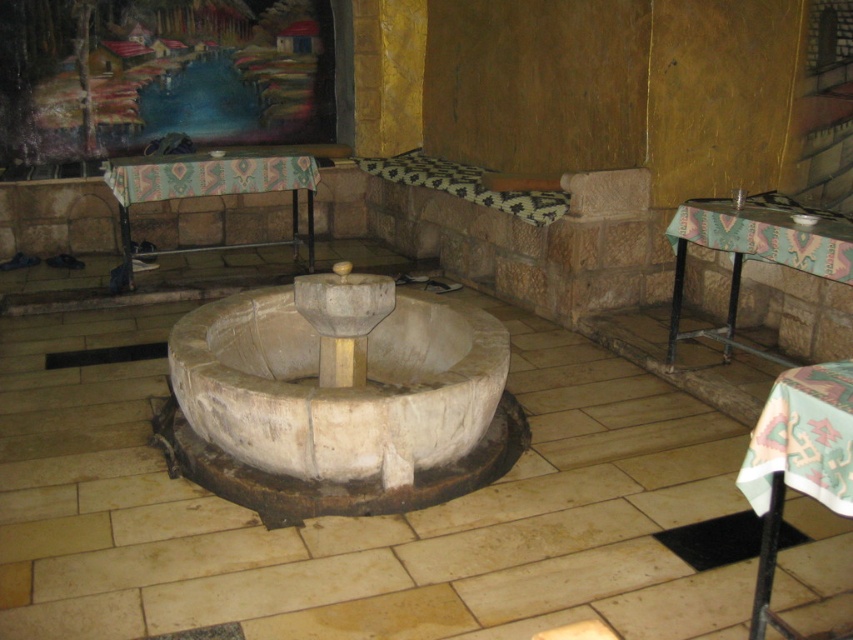
Is patterned fabric table at lower right shorter than patterned fabric table at left?

Correct, patterned fabric table at lower right is not as tall as patterned fabric table at left.

Is patterned fabric table at lower right in front of patterned fabric table at left?

Yes, patterned fabric table at lower right is in front of patterned fabric table at left.

Is point (824, 420) closer to viewer compared to point (146, 186)?

Yes, it is.

Identify the location of patterned fabric table at lower right. The width and height of the screenshot is (853, 640). (798, 461).

Can you confirm if smooth stone fountain at center is thinner than patterned fabric table at left?

No, smooth stone fountain at center is not thinner than patterned fabric table at left.

How much distance is there between smooth stone fountain at center and patterned fabric table at left?

They are 7.43 feet apart.

Who is more distant from viewer, (283, 394) or (292, 163)?

The point (292, 163) is more distant.

Where is `smooth stone fountain at center`? smooth stone fountain at center is located at coordinates (340, 397).

Is smooth stone fountain at center above textured fabric table at center?

No.

Is point (456, 476) farther from viewer compared to point (706, 236)?

No, (456, 476) is in front of (706, 236).

You are a GUI agent. You are given a task and a screenshot of the screen. Output one action in this format:
    pyautogui.click(x=<x>, y=<y>)
    Task: Click on the smooth stone fountain at center
    This screenshot has width=853, height=640.
    Given the screenshot: What is the action you would take?
    pyautogui.click(x=340, y=397)